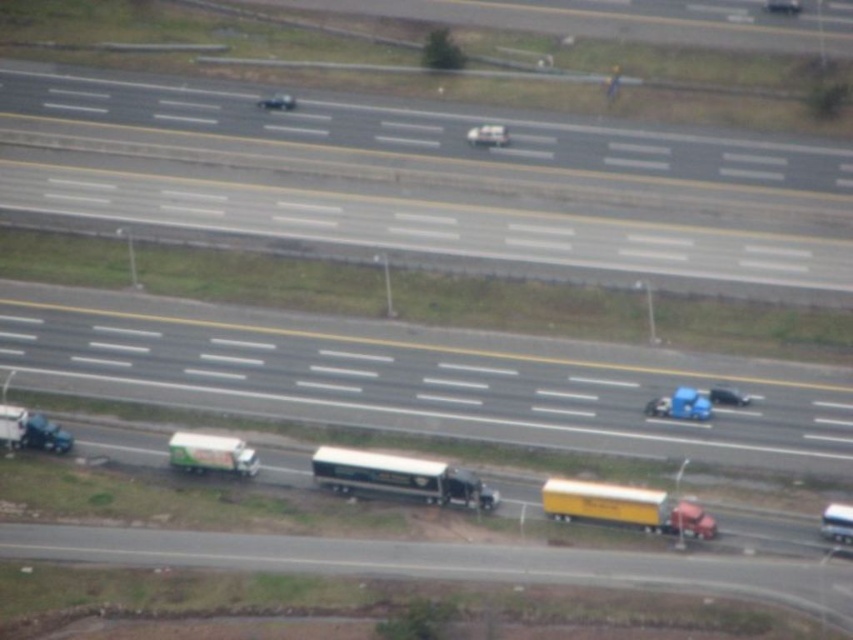
You are a delivery driver who needs to pass through the highway scene. You see a blue matte truck at center and a metallic silver truck at lower right. Which truck takes up more space on the road?

The blue matte truck at center has a greater width than the metallic silver truck at lower right, so it occupies more space on the road.